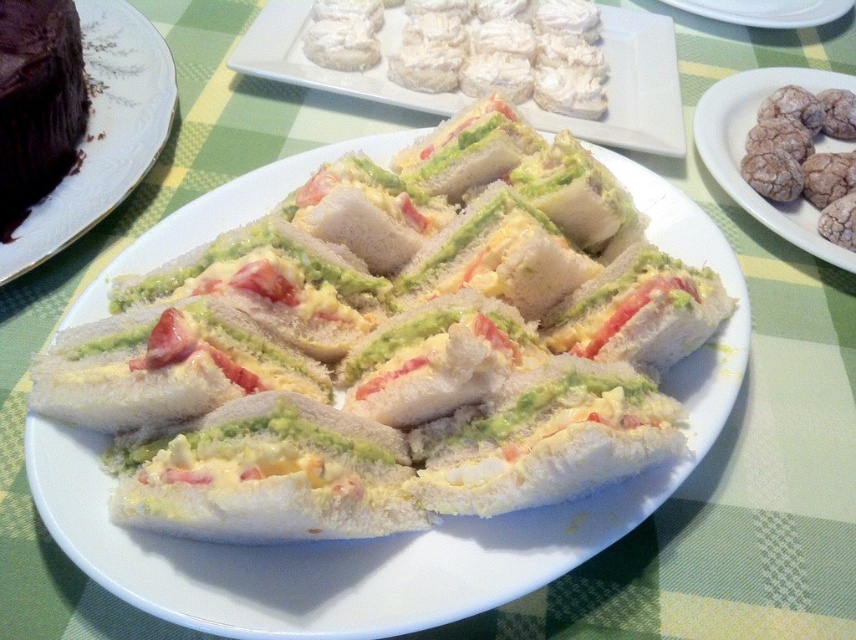
You are at a buffet and want to reach the chocolate matte cake at upper left, which is on a table. If you are currently standing 2 feet away from the table, can you grab it without moving closer?

The chocolate matte cake at upper left is 3.29 feet from the viewer. Since you are standing 2 feet away from the table, the cake is still 1.29 feet away from you, so you cannot reach it without moving closer.

You are a food critic standing in front of the plate of finger sandwiches. You need to reach for the closest point between point [631,58] and point [721,122]. Which point should you reach for?

Point [631,58] is closer to you than point [721,122], so you should reach for point [631,58].

You are at a tea party and want to grab a sandwich from the plate. Since both the white cream cheese sandwiches at center and the white ceramic plate at center are in your view, which one is closer to you?

The white cream cheese sandwiches at center are closer to you because they are in front of the white ceramic plate at center.